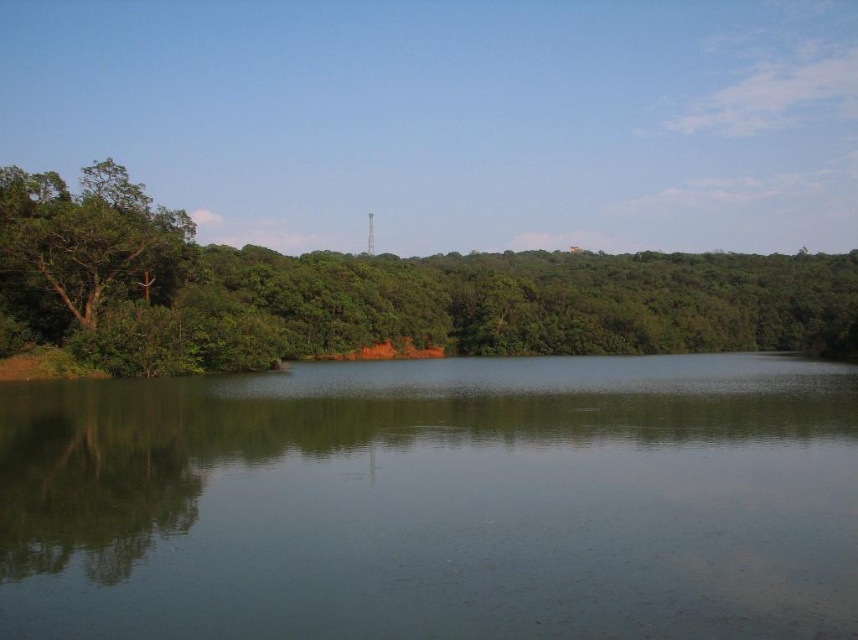
You are standing at the edge of the water and see the green smooth water at center and the green leafy tree at left. Which object is closer to you?

The green smooth water at center is closer to you because it is positioned below the green leafy tree at left, indicating it is in the foreground.

You are a small boat operator who needs to navigate between the green smooth water at center and the green matte tree at left. The boat requires a minimum of 175 feet of space to safely maneuver. Based on the scene, can you safely navigate your boat between these two objects?

The green smooth water at center and green matte tree at left are 174.91 feet apart from each other. Since the required minimum space is 175 feet, the distance is slightly insufficient, so the boat cannot safely navigate between them.

You are standing on the edge of the water and see the green smooth water at center and the green matte tree at left. Which object is positioned to the right of the other?

The green smooth water at center is positioned to the right of the green matte tree at left.